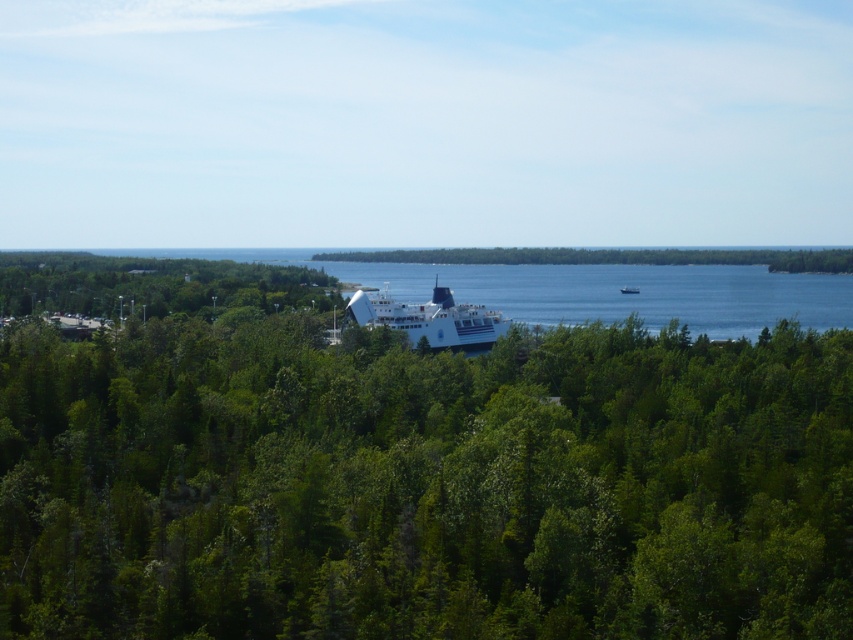
Can you confirm if blue water at center is positioned below white glossy cruise ship at center?

Actually, blue water at center is above white glossy cruise ship at center.

The width and height of the screenshot is (853, 640). Find the location of `blue water at center`. blue water at center is located at coordinates (624, 294).

This screenshot has width=853, height=640. Describe the element at coordinates (624, 294) in the screenshot. I see `blue water at center` at that location.

The width and height of the screenshot is (853, 640). Find the location of `blue water at center`. blue water at center is located at coordinates (624, 294).

Can you confirm if green leafy trees at center is positioned to the right of white glossy ship at center?

No, green leafy trees at center is not to the right of white glossy ship at center.

This screenshot has height=640, width=853. Describe the element at coordinates (422, 484) in the screenshot. I see `green leafy trees at center` at that location.

Is point (428, 577) closer to viewer compared to point (637, 291)?

Yes, point (428, 577) is closer to viewer.

I want to click on green leafy trees at center, so click(x=422, y=484).

This screenshot has width=853, height=640. I want to click on green leafy trees at center, so click(422, 484).